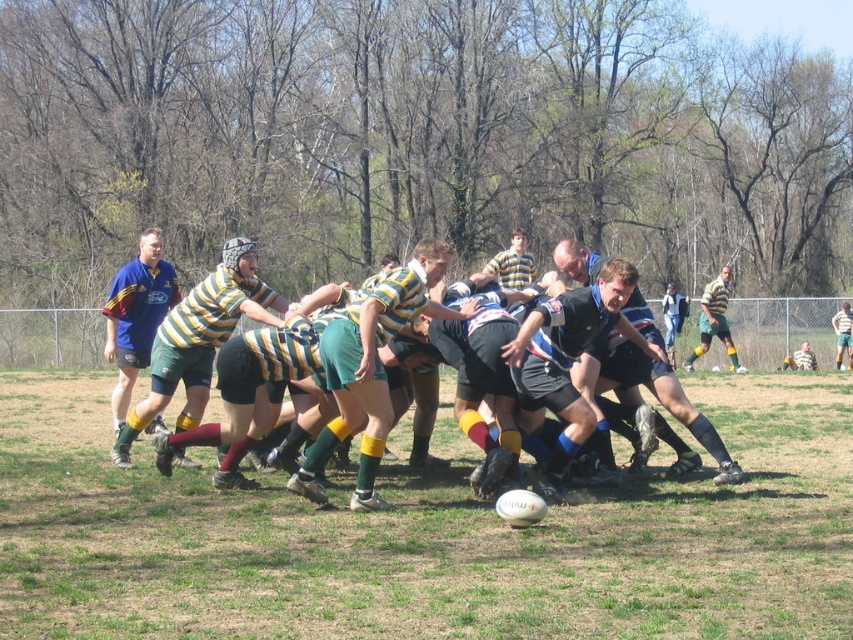
You are a rugby player positioned at the edge of the field. You need to pass the ball to your teammate who is standing near the green grass at center and the matte black shorts at center. Which direction should you aim your pass to reach both teammates?

You should aim your pass to the left side of the matte black shorts at center because the green grass at center is located to the left of the matte black shorts at center, indicating that the teammate near the green grass is positioned further left.